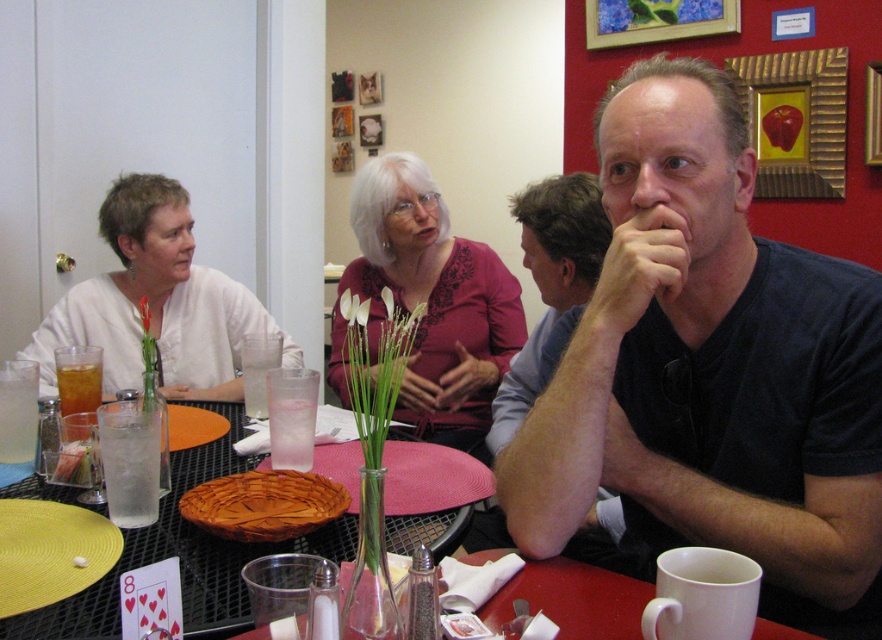
Question: Is clear glass at table center above translucent glass beverage at table left?

Choices:
 (A) yes
 (B) no

Answer: (A)

Question: Which point is closer to the camera?

Choices:
 (A) (408, 193)
 (B) (172, 179)
 (C) (12, 397)

Answer: (C)

Question: Which object is farther from the camera taking this photo?

Choices:
 (A) brown woven basket at center
 (B) translucent glass beverage at table left
 (C) clear glass ice at table left

Answer: (B)

Question: Which object appears farthest from the camera in this image?

Choices:
 (A) clear glass vase with green stems at center
 (B) clear glass ice at table left
 (C) white matte shirt at left
 (D) clear glass at center

Answer: (C)

Question: In this image, where is matte pink blouse at center located relative to clear glass at center?

Choices:
 (A) left
 (B) right

Answer: (B)

Question: Does white matte shirt at left have a lesser width compared to clear glass vase with green stems at center?

Choices:
 (A) yes
 (B) no

Answer: (B)